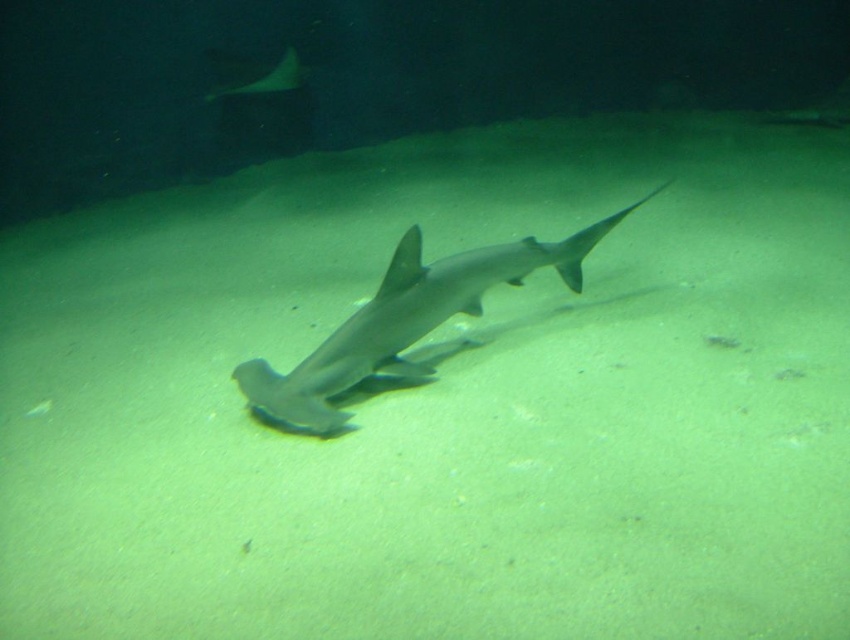
You are a marine biologist observing this underwater scene. You notice the gray matte shark at center and the smooth gray stingray at upper center. Which of these two marine animals is positioned higher in the water column?

The smooth gray stingray at upper center is positioned higher in the water column than the gray matte shark at center.

You are a marine biologist observing underwater life. You notice the gray matte shark at center and the smooth gray stingray at upper center. Which of these two marine animals is larger in size?

Answer: The gray matte shark at center is bigger than the smooth gray stingray at upper center.

From the picture: You are a marine biologist observing an underwater scene. You notice the gray matte shark at center and the smooth gray stingray at upper center. Which of these two marine animals is taller in this image?

The gray matte shark at center is much taller than the smooth gray stingray at upper center.